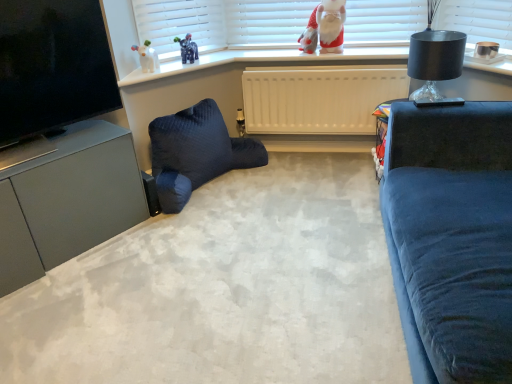
Question: Is matte black tv at left not within red plush santa at upper center?

Choices:
 (A) yes
 (B) no

Answer: (A)

Question: Considering the relative sizes of matte black tv at left and red plush santa at upper center in the image provided, is matte black tv at left wider than red plush santa at upper center?

Choices:
 (A) yes
 (B) no

Answer: (A)

Question: Does matte black tv at left contain red plush santa at upper center?

Choices:
 (A) yes
 (B) no

Answer: (B)

Question: Does matte black tv at left have a larger size compared to red plush santa at upper center?

Choices:
 (A) no
 (B) yes

Answer: (B)

Question: Considering the relative positions of matte black tv at left and red plush santa at upper center in the image provided, is matte black tv at left to the right of red plush santa at upper center from the viewer's perspective?

Choices:
 (A) no
 (B) yes

Answer: (A)

Question: Is matte black tv at left directly adjacent to red plush santa at upper center?

Choices:
 (A) no
 (B) yes

Answer: (A)

Question: Is black glass lamp at upper right placed right next to dark blue quilted bean bag chair at lower left?

Choices:
 (A) no
 (B) yes

Answer: (A)

Question: Could dark blue quilted bean bag chair at lower left be considered to be inside black glass lamp at upper right?

Choices:
 (A) no
 (B) yes

Answer: (A)

Question: Is black glass lamp at upper right far from dark blue quilted bean bag chair at lower left?

Choices:
 (A) no
 (B) yes

Answer: (B)

Question: Is black glass lamp at upper right positioned behind dark blue quilted bean bag chair at lower left?

Choices:
 (A) yes
 (B) no

Answer: (B)

Question: Could you tell me if black glass lamp at upper right is turned towards dark blue quilted bean bag chair at lower left?

Choices:
 (A) yes
 (B) no

Answer: (A)

Question: Can you confirm if black glass lamp at upper right is wider than dark blue quilted bean bag chair at lower left?

Choices:
 (A) yes
 (B) no

Answer: (B)

Question: Is matte black tv at left in contact with satin grey cabinet at lower left?

Choices:
 (A) no
 (B) yes

Answer: (A)